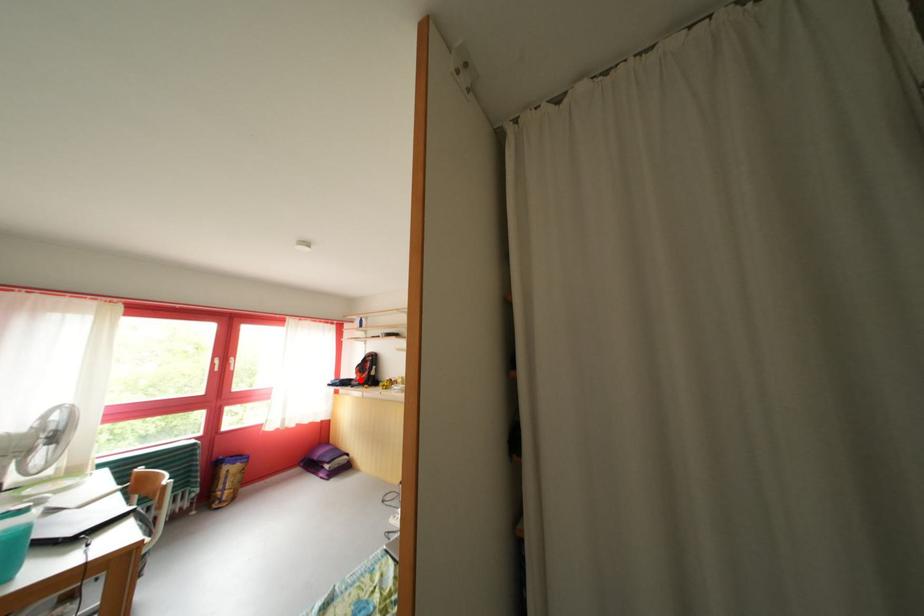
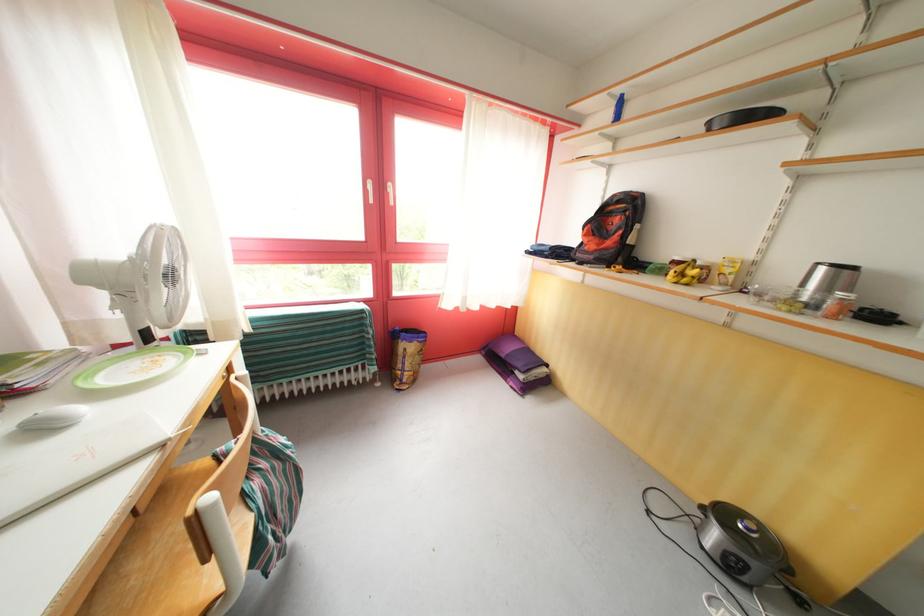
Question: I am providing you with two images of the same scene from different viewpoints. In image1, a red point is highlighted. Considering the same 3D point in image2, which of the following is correct?

Choices:
 (A) It is closer
 (B) It is farther

Answer: (A)